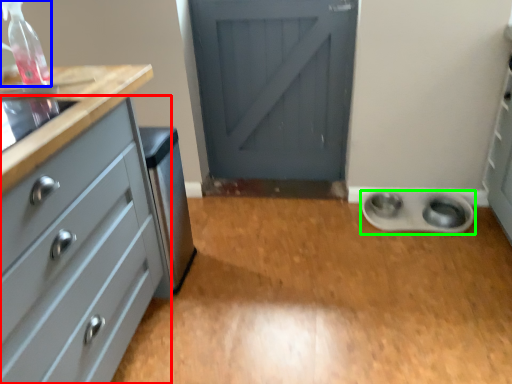
Question: Estimate the real-world distances between objects in this image. Which object is closer to chest of drawers (highlighted by a red box), bottle (highlighted by a blue box) or appliance (highlighted by a green box)?

Choices:
 (A) bottle
 (B) appliance

Answer: (A)